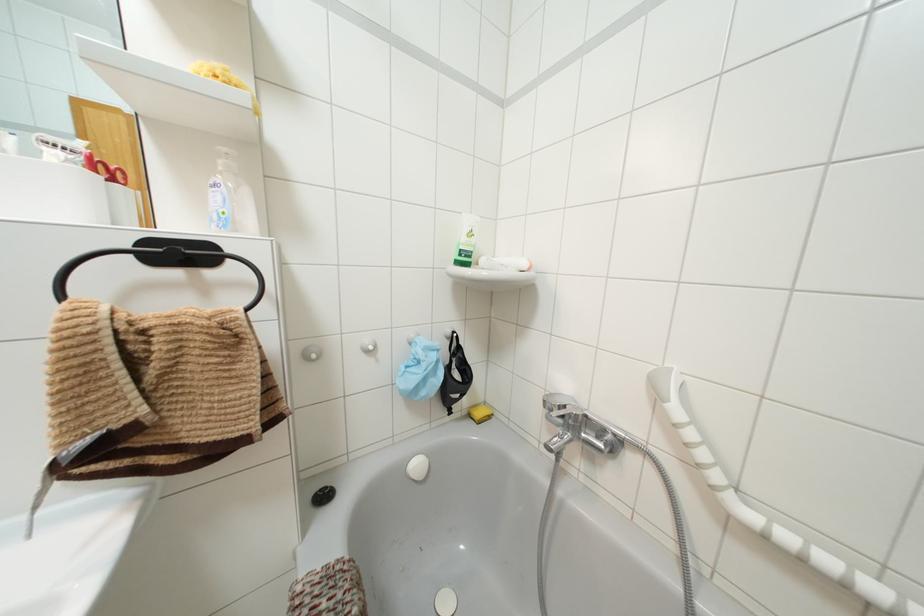
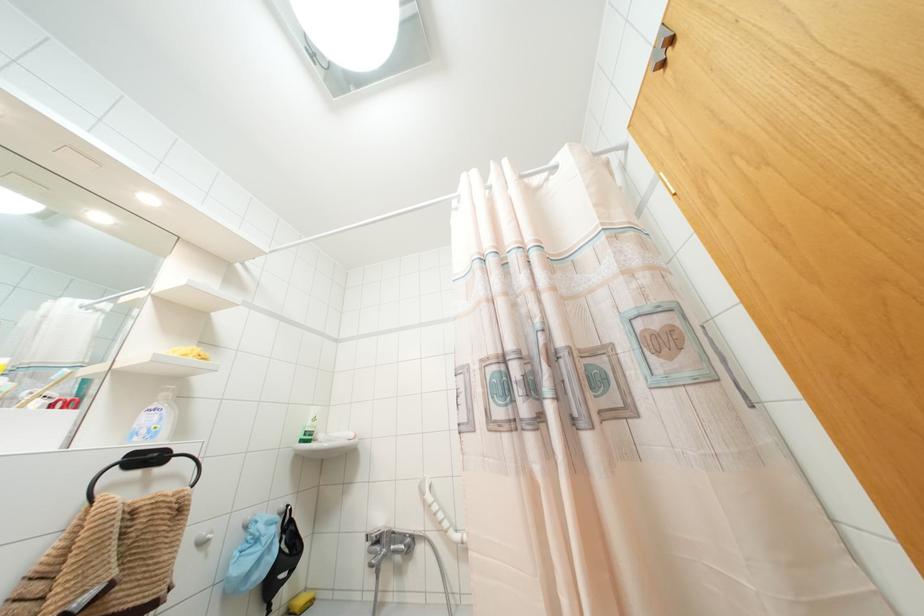
In the second image, find the point that corresponds to (x=469, y=233) in the first image.

(312, 419)